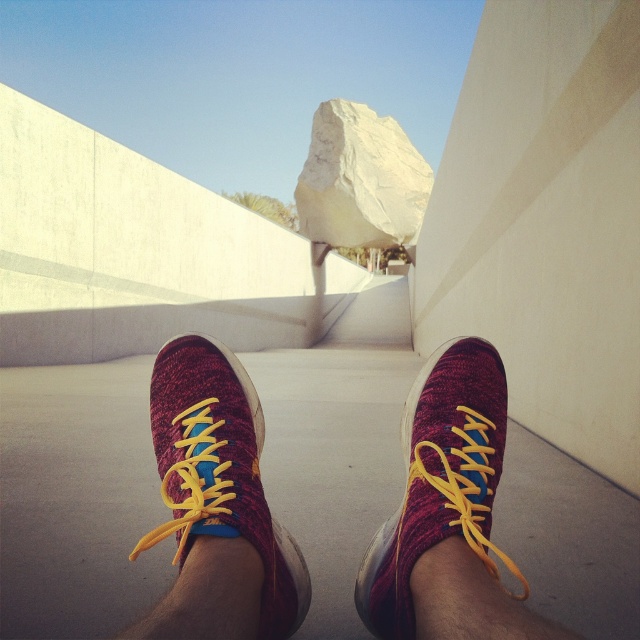
You are standing in a modern outdoor space with beige walls and a large rock. You see a point marked at coordinates (216, 504). What object is located at that point?

The point at coordinates (216, 504) corresponds to the knitted fabric sneakers at center.

You are standing in an outdoor area with minimalist architecture. You notice your knitted fabric sneakers at center. If you want to move towards the large irregularly shaped rock resting on the wall, which direction should you move relative to your current position?

Since the knitted fabric sneakers at center are located at point (216, 504), you should move towards the large irregularly shaped rock by moving towards the direction of the rock, which is not specified in the scene description. However, based on the coordinates, if (0, 0) is the bottom left corner, moving towards higher x or y coordinates might be needed. But without explicit spatial relation between the rock and the sneakers, an accurate direction can not be determined. Please check the scene description.